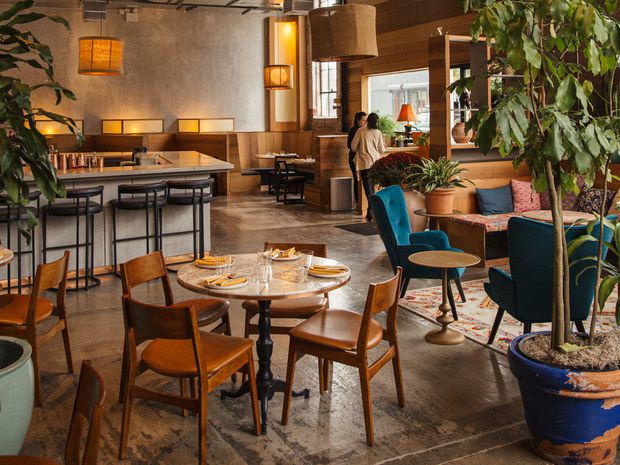
Find the location of a particular element. potted plants is located at coordinates (578, 386), (7, 181), (435, 193), (387, 128).